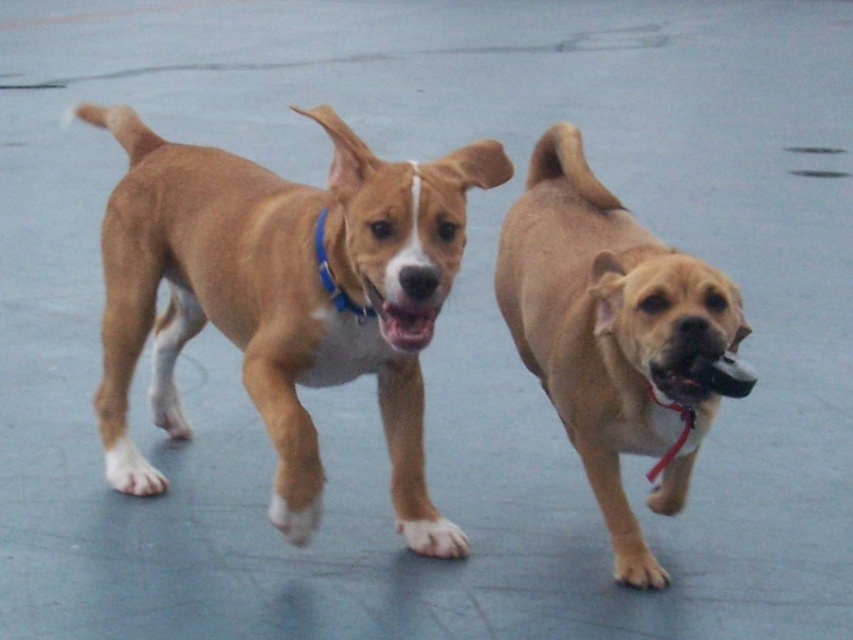
Question: Estimate the real-world distances between objects in this image. Which object is farther from the light brown fur at center?

Choices:
 (A) brown matte dog at center
 (B) blue fabric neckband at center
 (C) pink glossy mouth at center

Answer: (B)

Question: Does brown matte dog at center appear over pink glossy mouth at center?

Choices:
 (A) yes
 (B) no

Answer: (A)

Question: Is pink glossy mouth at center below blue fabric neckband at center?

Choices:
 (A) no
 (B) yes

Answer: (B)

Question: Among these objects, which one is farthest from the camera?

Choices:
 (A) light brown fur at center
 (B) blue fabric neckband at center

Answer: (B)

Question: Based on their relative distances, which object is farther from the blue fabric neckband at center?

Choices:
 (A) brown matte dog at center
 (B) light brown fur at center

Answer: (B)

Question: Is brown matte dog at center to the left of pink glossy mouth at center from the viewer's perspective?

Choices:
 (A) yes
 (B) no

Answer: (A)